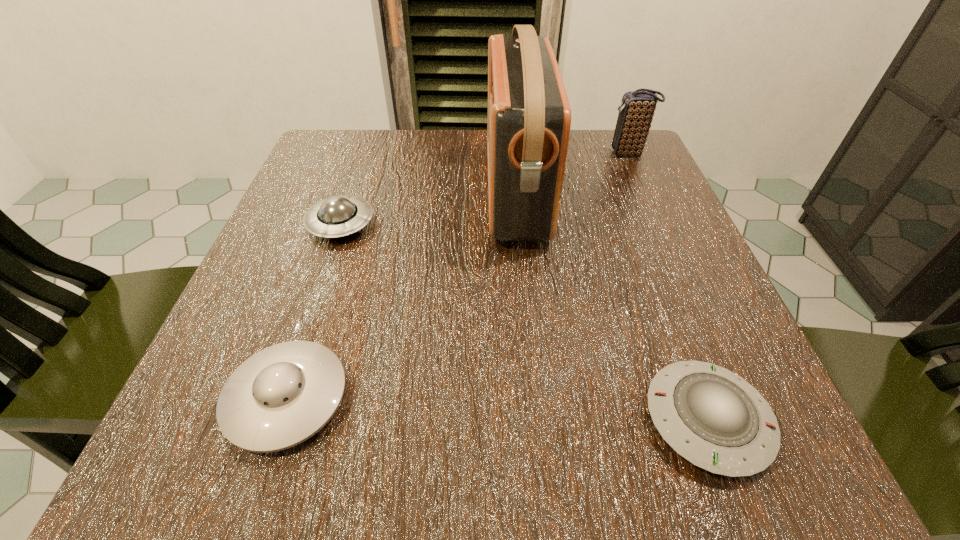
Where is `free space between the clutch bag and the shortest saucer`? The width and height of the screenshot is (960, 540). free space between the clutch bag and the shortest saucer is located at coordinates tap(667, 287).

Locate an element on the screen. The height and width of the screenshot is (540, 960). empty space that is in between the farthest saucer and the third object from left to right is located at coordinates (428, 209).

Locate an element on the screen. Image resolution: width=960 pixels, height=540 pixels. empty space that is in between the farthest saucer and the clutch bag is located at coordinates (485, 189).

Locate an element on the screen. object that ranks as the closest to the clutch bag is located at coordinates (529, 117).

Find the location of a particular element. the closest object relative to the shortest saucer is located at coordinates (529, 117).

Identify which saucer is the second closest to the rightmost saucer. Please provide its 2D coordinates. Your answer should be formatted as a tuple, i.e. [(x, y)], where the tuple contains the x and y coordinates of a point satisfying the conditions above.

[(338, 216)]

The image size is (960, 540). What are the coordinates of `saucer that can be found as the closest to the tallest object` in the screenshot? It's located at (338, 216).

At what (x,y) coordinates should I click in order to perform the action: click on vacant region that satisfies the following two spatial constraints: 1. with the zip open on the clutch bag; 2. on the front side of the rightmost saucer. Please return your answer as a coordinate pair (x, y). Looking at the image, I should click on (747, 420).

Find the location of a particular element. free space that satisfies the following two spatial constraints: 1. on the front-facing side of the shortest saucer; 2. on the right side of the radio receiver is located at coordinates (538, 420).

Find the location of a particular element. free space that satisfies the following two spatial constraints: 1. on the front-facing side of the radio receiver; 2. on the front side of the farthest saucer is located at coordinates (518, 224).